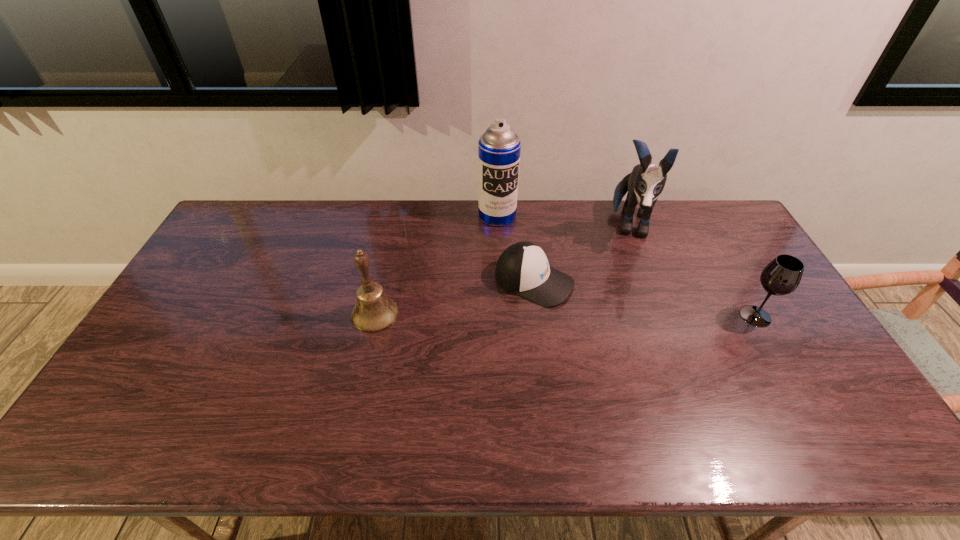
The image size is (960, 540). Identify the location of vacant area situated on the label side of the aerosol can. (525, 310).

I want to click on vacant space located on the label side of the aerosol can, so click(x=518, y=286).

The height and width of the screenshot is (540, 960). What are the coordinates of `free location located on the front panel of the shortest object` in the screenshot? It's located at (640, 325).

Find the location of `free space located 0.400m on the front panel of the shortest object`. free space located 0.400m on the front panel of the shortest object is located at coordinates (705, 353).

Find the location of `free space located on the front panel of the shortest object`. free space located on the front panel of the shortest object is located at coordinates (664, 335).

You are a GUI agent. You are given a task and a screenshot of the screen. Output one action in this format:
    pyautogui.click(x=<x>, y=<y>)
    Task: Click on the free spot located on the front-facing side of the puppy
    The image size is (960, 540).
    Given the screenshot: What is the action you would take?
    pyautogui.click(x=628, y=315)

At what (x,y) coordinates should I click in order to perform the action: click on free location located 0.400m on the front-facing side of the puppy. Please return your answer as a coordinate pair (x, y). This screenshot has height=540, width=960. Looking at the image, I should click on (626, 347).

At what (x,y) coordinates should I click in order to perform the action: click on free space located 0.370m on the front-facing side of the puppy. Please return your answer as a coordinate pair (x, y). Looking at the image, I should click on (626, 339).

This screenshot has height=540, width=960. I want to click on aerosol can situated at the far edge, so click(x=499, y=147).

Identify the location of puppy present at the far edge. The width and height of the screenshot is (960, 540). (645, 183).